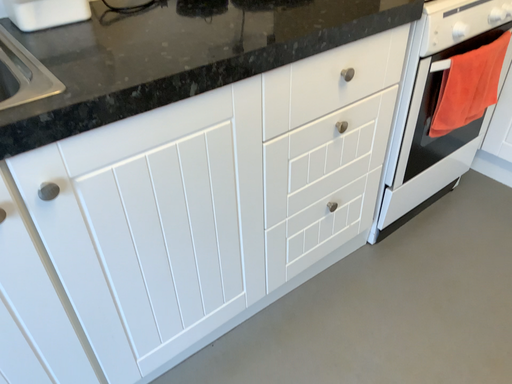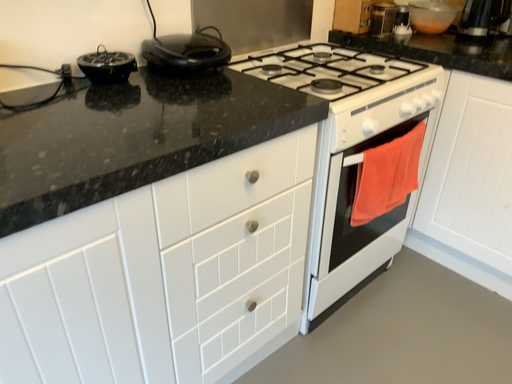
Question: Which way did the camera rotate in the video?

Choices:
 (A) rotated downward
 (B) rotated upward

Answer: (B)